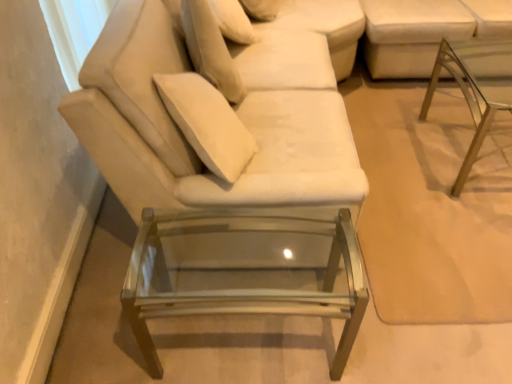
Where is `white fabric couch at upper right`? This screenshot has width=512, height=384. white fabric couch at upper right is located at coordinates (425, 31).

What is the approximate height of velvet beige pillow at upper center?

velvet beige pillow at upper center is 42.07 centimeters tall.

Where is `velvet beige couch at center`? This screenshot has height=384, width=512. velvet beige couch at center is located at coordinates (213, 117).

Measure the distance between velvet beige couch at center and camera.

velvet beige couch at center and camera are 3.70 feet apart from each other.

The image size is (512, 384). What do you see at coordinates (475, 87) in the screenshot?
I see `transparent glass table at right, marked as the 2th table in a left-to-right arrangement` at bounding box center [475, 87].

I want to click on white fabric couch at upper right, so coord(425,31).

From the image's perspective, is white fabric couch at upper right located beneath velvet beige couch at center?

Actually, white fabric couch at upper right appears above velvet beige couch at center in the image.

Between white fabric couch at upper right and velvet beige couch at center, which one has less height?

white fabric couch at upper right.

Which object is wider, white fabric couch at upper right or velvet beige couch at center?

white fabric couch at upper right is wider.

Is white fabric couch at upper right not near velvet beige couch at center?

That's right, there is a large distance between white fabric couch at upper right and velvet beige couch at center.

Which is closer, (393, 60) or (458, 190)?

The point (458, 190) is closer.

Which object is positioned more to the right, white fabric couch at upper right or transparent glass table at right, marked as the first table in a top-to-bottom arrangement?

Positioned to the right is white fabric couch at upper right.

Locate an element on the screen. The width and height of the screenshot is (512, 384). couch that appears above the transparent glass table at right, marked as the 2th table in a left-to-right arrangement (from a real-world perspective) is located at coordinates (425, 31).

Who is shorter, white fabric couch at upper right or transparent glass table at right, which ranks as the 1th table in right-to-left order?

With less height is transparent glass table at right, which ranks as the 1th table in right-to-left order.

Considering the relative positions of clear glass table at lower center, acting as the first table starting from the left, and velvet beige couch at center in the image provided, is clear glass table at lower center, acting as the first table starting from the left, to the right of velvet beige couch at center from the viewer's perspective?

Yes, clear glass table at lower center, acting as the first table starting from the left, is to the right of velvet beige couch at center.

Considering the relative sizes of clear glass table at lower center, which is the 1th table from bottom to top, and velvet beige couch at center in the image provided, is clear glass table at lower center, which is the 1th table from bottom to top, thinner than velvet beige couch at center?

Indeed, clear glass table at lower center, which is the 1th table from bottom to top, has a lesser width compared to velvet beige couch at center.

From a real-world perspective, is clear glass table at lower center, acting as the first table starting from the left, located higher than velvet beige couch at center?

No.

Considering the relative sizes of clear glass table at lower center, which appears as the first table when viewed from the front, and velvet beige couch at center in the image provided, is clear glass table at lower center, which appears as the first table when viewed from the front, bigger than velvet beige couch at center?

No.

Is white fabric couch at upper right situated inside velvet beige pillow at upper center or outside?

white fabric couch at upper right is not enclosed by velvet beige pillow at upper center.

Relative to velvet beige pillow at upper center, is white fabric couch at upper right in front or behind?

white fabric couch at upper right is positioned farther from the viewer than velvet beige pillow at upper center.

Looking at this image, would you consider white fabric couch at upper right to be distant from velvet beige pillow at upper center?

Yes, white fabric couch at upper right and velvet beige pillow at upper center are quite far apart.

From the image's perspective, is white fabric couch at upper right above or below velvet beige pillow at upper center?

Based on their image positions, white fabric couch at upper right is located above velvet beige pillow at upper center.

Is velvet beige pillow at upper center at the left side of transparent glass table at right, which ranks as the 1th table in right-to-left order?

Yes, velvet beige pillow at upper center is to the left of transparent glass table at right, which ranks as the 1th table in right-to-left order.

Is velvet beige pillow at upper center beside transparent glass table at right, marked as the first table in a top-to-bottom arrangement?

No.

Is velvet beige pillow at upper center bigger than transparent glass table at right, marked as the first table in a top-to-bottom arrangement?

No, velvet beige pillow at upper center is not bigger than transparent glass table at right, marked as the first table in a top-to-bottom arrangement.

Would you say velvet beige couch at center is a long distance from white fabric couch at upper right?

velvet beige couch at center is far away from white fabric couch at upper right.

The image size is (512, 384). Identify the location of studio couch above the white fabric couch at upper right (from a real-world perspective). (213, 117).

Is velvet beige couch at center facing away from white fabric couch at upper right?

No, velvet beige couch at center is not facing the opposite direction of white fabric couch at upper right.

Which object is further away from the camera taking this photo, velvet beige pillow at upper center or white fabric couch at upper right?

white fabric couch at upper right.

What's the angular difference between velvet beige pillow at upper center and white fabric couch at upper right's facing directions?

velvet beige pillow at upper center and white fabric couch at upper right are facing 86.2 degrees away from each other.

Which of these two, velvet beige pillow at upper center or white fabric couch at upper right, is thinner?

velvet beige pillow at upper center is thinner.

Consider the image. Could you tell me if velvet beige pillow at upper center is turned towards white fabric couch at upper right?

Yes.

The height and width of the screenshot is (384, 512). Identify the location of couch that is under the velvet beige couch at center (from a real-world perspective). (425, 31).

The height and width of the screenshot is (384, 512). Find the location of `couch above the transparent glass table at right, the second table in the front-to-back sequence (from the image's perspective)`. couch above the transparent glass table at right, the second table in the front-to-back sequence (from the image's perspective) is located at coordinates (425, 31).

Considering their positions, is velvet beige couch at center positioned closer to velvet beige pillow at upper center than white fabric couch at upper right?

velvet beige couch at center lies closer to velvet beige pillow at upper center than the other object.

In the scene shown: Looking at the image, which one is located further to clear glass table at lower center, which is the second table from back to front, velvet beige pillow at upper center or white fabric couch at upper right?

white fabric couch at upper right lies further to clear glass table at lower center, which is the second table from back to front, than the other object.

Which object lies further to the anchor point velvet beige pillow at upper center, clear glass table at lower center, which is the 2th table in right-to-left order, or velvet beige couch at center?

clear glass table at lower center, which is the 2th table in right-to-left order, lies further to velvet beige pillow at upper center than the other object.

Considering their positions, is velvet beige pillow at upper center positioned further to clear glass table at lower center, which is the second table from back to front, than velvet beige couch at center?

The object further to clear glass table at lower center, which is the second table from back to front, is velvet beige pillow at upper center.

Estimate the real-world distances between objects in this image. Which object is further from clear glass table at lower center, which appears as the first table when viewed from the front, white fabric couch at upper right or transparent glass table at right, marked as the 2th table in a left-to-right arrangement?

white fabric couch at upper right lies further to clear glass table at lower center, which appears as the first table when viewed from the front, than the other object.

Looking at the image, which one is located closer to velvet beige pillow at upper center, clear glass table at lower center, which is the second table from back to front, or white fabric couch at upper right?

clear glass table at lower center, which is the second table from back to front, is positioned closer to the anchor velvet beige pillow at upper center.

Estimate the real-world distances between objects in this image. Which object is further from velvet beige couch at center, velvet beige pillow at upper center or clear glass table at lower center, acting as the first table starting from the left?

clear glass table at lower center, acting as the first table starting from the left.

Considering their positions, is clear glass table at lower center, which is the 2th table in right-to-left order, positioned closer to transparent glass table at right, marked as the 2th table in a left-to-right arrangement, than white fabric couch at upper right?

Among the two, white fabric couch at upper right is located nearer to transparent glass table at right, marked as the 2th table in a left-to-right arrangement.

Where is `table situated between clear glass table at lower center, acting as the first table starting from the left, and white fabric couch at upper right from left to right`? table situated between clear glass table at lower center, acting as the first table starting from the left, and white fabric couch at upper right from left to right is located at coordinates (475, 87).

Where is `table between velvet beige pillow at upper center and transparent glass table at right, placed as the second table when sorted from bottom to top, from left to right`? The width and height of the screenshot is (512, 384). table between velvet beige pillow at upper center and transparent glass table at right, placed as the second table when sorted from bottom to top, from left to right is located at coordinates (246, 269).

The height and width of the screenshot is (384, 512). Identify the location of table between velvet beige couch at center and transparent glass table at right, which ranks as the 1th table in right-to-left order. (246, 269).

You are a GUI agent. You are given a task and a screenshot of the screen. Output one action in this format:
    pyautogui.click(x=<x>, y=<y>)
    Task: Click on the studio couch situated between velvet beige pillow at upper center and white fabric couch at upper right from left to right
    
    Given the screenshot: What is the action you would take?
    pyautogui.click(x=213, y=117)